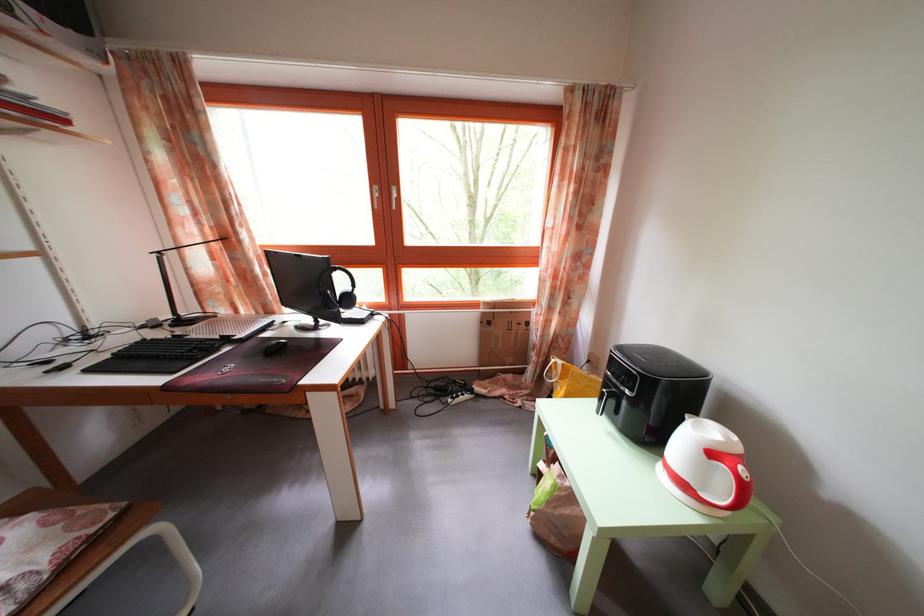
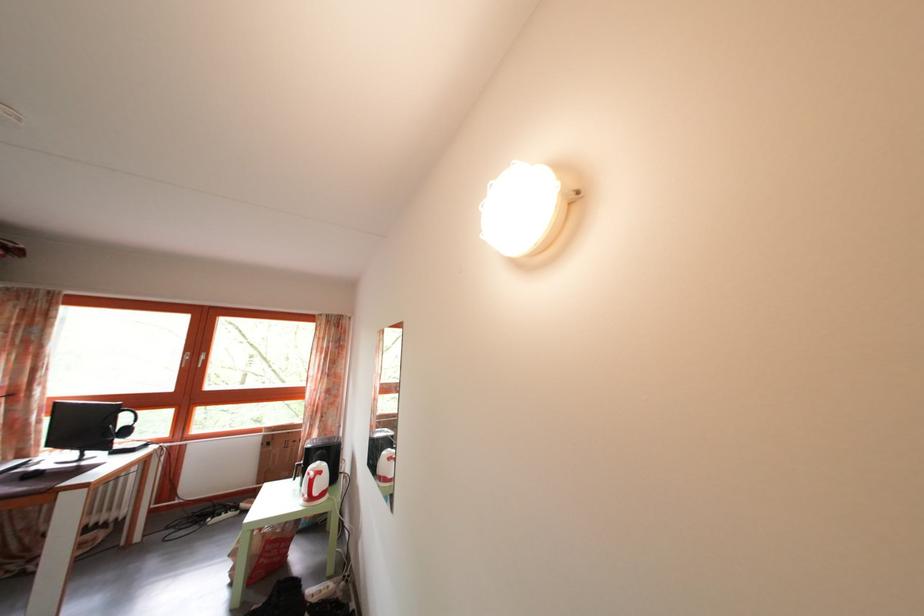
The point at (355, 321) is marked in the first image. Where is the corresponding point in the second image?

(128, 451)